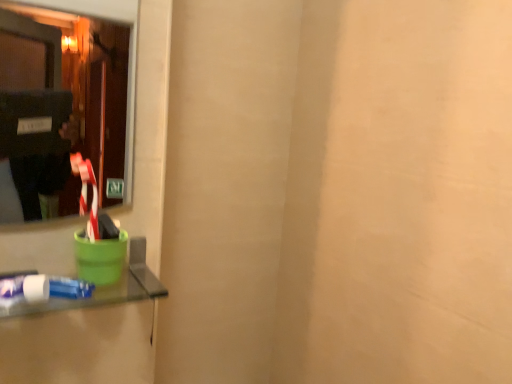
Describe the element at coordinates (101, 294) in the screenshot. I see `green plastic cup at lower left` at that location.

The width and height of the screenshot is (512, 384). In order to click on green plastic cup at lower left in this screenshot , I will do `click(101, 294)`.

Where is `green plastic cup at lower left`? green plastic cup at lower left is located at coordinates (101, 294).